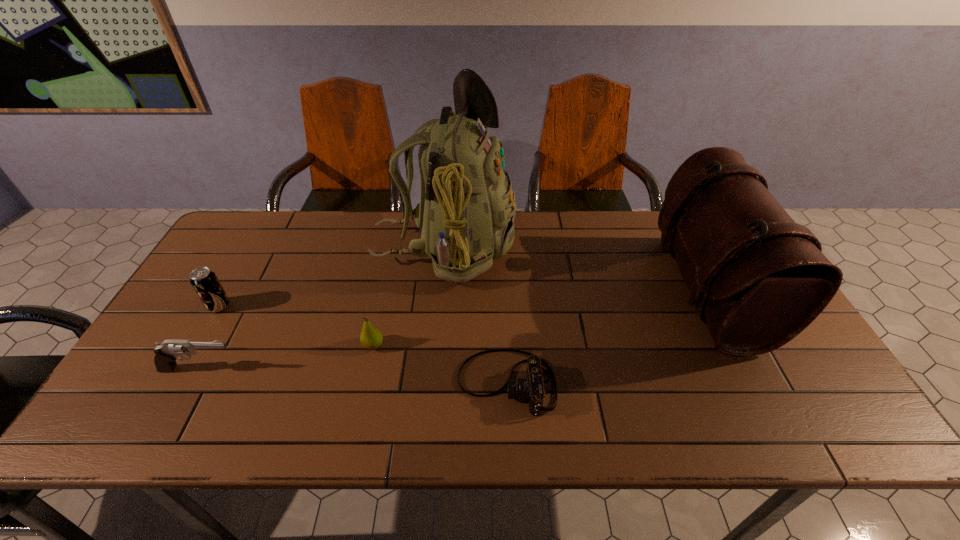
Where is `free space between the camera and the rightmost object`? Image resolution: width=960 pixels, height=540 pixels. free space between the camera and the rightmost object is located at coordinates (607, 336).

I want to click on blank region between the gun and the camera, so click(353, 376).

Locate an element on the screen. free space that is in between the pear and the tallest object is located at coordinates (409, 297).

The image size is (960, 540). I want to click on free spot between the gun and the rightmost object, so click(x=453, y=330).

You are a GUI agent. You are given a task and a screenshot of the screen. Output one action in this format:
    pyautogui.click(x=<x>, y=<y>)
    Task: Click on the free area in between the tallest object and the camera
    
    Given the screenshot: What is the action you would take?
    pyautogui.click(x=475, y=316)

The height and width of the screenshot is (540, 960). Identify the location of vacant space in between the rightmost object and the pear. (540, 318).

At what (x,y) coordinates should I click in order to perform the action: click on object that is the closest to the backpack. Please return your answer as a coordinate pair (x, y). Looking at the image, I should click on (371, 338).

Identify the location of object that stands as the closest to the soda can. (166, 353).